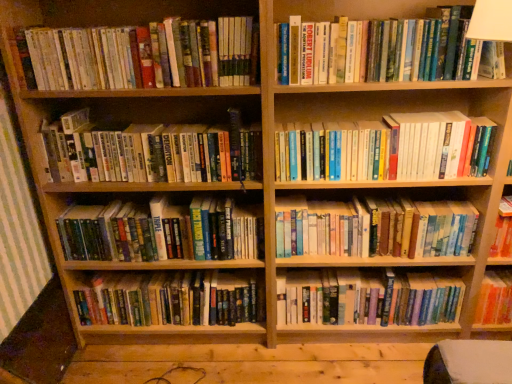
Question: Is hardcover book at center, which is the fourth book in bottom-to-top order, bigger than hardcover books at center, the 2th book positioned from the bottom?

Choices:
 (A) yes
 (B) no

Answer: (A)

Question: Is hardcover book at center, positioned as the fifth book in top-to-bottom order, placed right next to hardcover books at center, the 2th book positioned from the bottom?

Choices:
 (A) yes
 (B) no

Answer: (B)

Question: Does hardcover book at center, which is the fourth book in bottom-to-top order, appear on the left side of hardcover books at center, the 2th book positioned from the bottom?

Choices:
 (A) yes
 (B) no

Answer: (A)

Question: Is hardcover book at center, positioned as the fifth book in top-to-bottom order, behind hardcover books at center, which appears as the 7th book when viewed from the top?

Choices:
 (A) no
 (B) yes

Answer: (A)

Question: Does hardcover book at center, which is the fourth book in bottom-to-top order, have a lesser height compared to hardcover books at center, which appears as the 7th book when viewed from the top?

Choices:
 (A) yes
 (B) no

Answer: (A)

Question: Would you say hardcover books at upper right is inside or outside hardcover book at center, which is the fourth book in bottom-to-top order?

Choices:
 (A) outside
 (B) inside

Answer: (A)

Question: From the image's perspective, relative to hardcover book at center, which is the fourth book in bottom-to-top order, is hardcover books at upper right above or below?

Choices:
 (A) above
 (B) below

Answer: (B)

Question: In terms of size, does hardcover books at upper right appear bigger or smaller than hardcover book at center, which is the fourth book in bottom-to-top order?

Choices:
 (A) big
 (B) small

Answer: (A)

Question: In the image, is hardcover books at upper right on the left side or the right side of hardcover book at center, which is the fourth book in bottom-to-top order?

Choices:
 (A) left
 (B) right

Answer: (B)

Question: From the image's perspective, relative to hardcover books at center, arranged as the 3th book when ordered from the bottom, is hardcover books at upper left, the second book from the top, above or below?

Choices:
 (A) above
 (B) below

Answer: (A)

Question: In terms of height, does hardcover books at upper left, the second book from the top, look taller or shorter compared to hardcover books at center, positioned as the 6th book in top-to-bottom order?

Choices:
 (A) tall
 (B) short

Answer: (A)

Question: Is point (39, 82) closer or farther from the camera than point (303, 248)?

Choices:
 (A) farther
 (B) closer

Answer: (B)

Question: Is hardcover books at upper left, which appears as the seventh book when ordered from the bottom, spatially inside hardcover books at center, arranged as the 3th book when ordered from the bottom, or outside of it?

Choices:
 (A) inside
 (B) outside

Answer: (B)

Question: Considering the relative positions of hardcover books at center, arranged as the 3th book when ordered from the bottom, and hardcover books at center, positioned as the fourth book in top-to-bottom order, in the image provided, is hardcover books at center, arranged as the 3th book when ordered from the bottom, to the left or to the right of hardcover books at center, positioned as the fourth book in top-to-bottom order,?

Choices:
 (A) left
 (B) right

Answer: (B)

Question: In terms of width, does hardcover books at center, arranged as the 3th book when ordered from the bottom, look wider or thinner when compared to hardcover books at center, which appears as the fifth book when ordered from the bottom?

Choices:
 (A) thin
 (B) wide

Answer: (A)